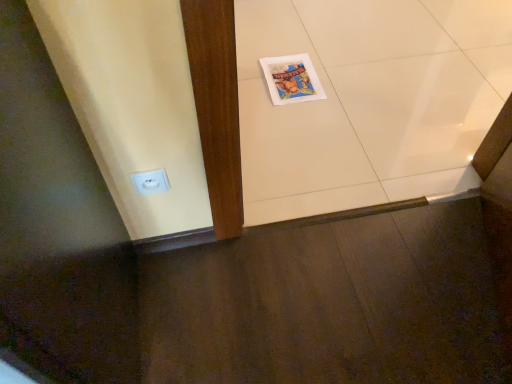
This screenshot has height=384, width=512. What are the coordinates of `vacant area on top of matte paper comic book at center (from a real-world perspective)` in the screenshot? It's located at (294, 73).